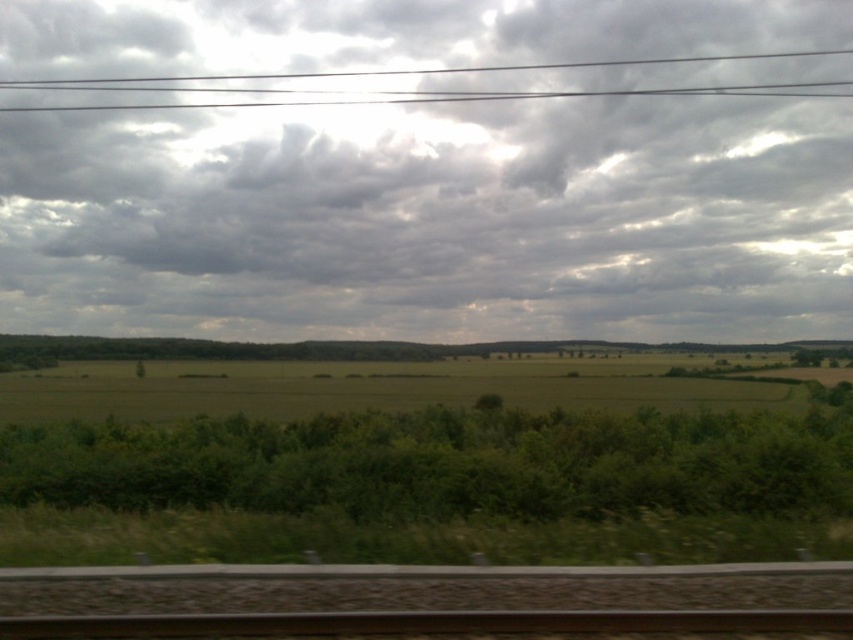
Question: Which object appears farthest from the camera in this image?

Choices:
 (A) black wires at upper center
 (B) brown gravel train track at bottom
 (C) brown metallic train track at bottom

Answer: (A)

Question: Does cloudy sky at upper center appear on the left side of brown metallic train track at bottom?

Choices:
 (A) no
 (B) yes

Answer: (B)

Question: Is cloudy sky at upper center bigger than black wires at upper center?

Choices:
 (A) yes
 (B) no

Answer: (A)

Question: Which of the following is the closest to the observer?

Choices:
 (A) brown gravel train track at bottom
 (B) black wires at upper center

Answer: (A)

Question: Can you confirm if brown gravel train track at bottom is thinner than brown metallic train track at bottom?

Choices:
 (A) yes
 (B) no

Answer: (A)

Question: Which point is closer to the camera?

Choices:
 (A) (419, 97)
 (B) (325, 592)
 (C) (486, 611)
 (D) (173, 52)

Answer: (C)